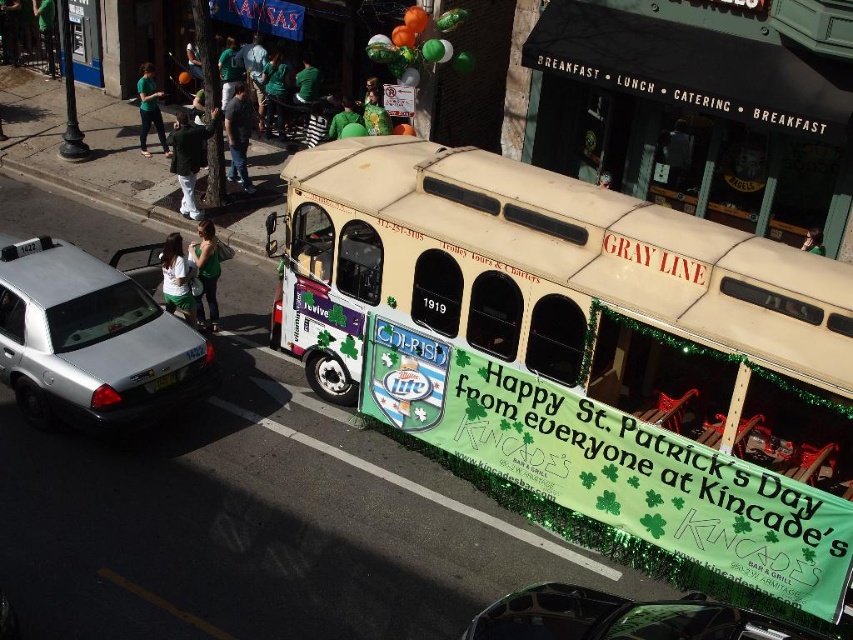
You are standing on the sidewalk next to the silver metallic taxi cab at left. You want to cross the street to reach the other side. The crosswalk is 10 meters away from you. Can you safely cross the street before a car traveling at 20 km per hour arrives? Assume the car is 30 meters behind you and approaching at a constant speed. Calculate the time it takes for the car to reach you and compare it with the time needed to cross the street.

The car is 30 meters behind you and approaching at 20 km per hour. Converting 20 km per hour to meters per second gives approximately 5.56 m per second. The time for the car to reach you is 30 meters divided by 5.56 m per second, which is about 5.4 seconds. To cross 10 meters at a walking speed of 1.4 m per second, it would take about 7.1 seconds. Since the car arrives before you finish crossing, it is not safe to cross.

You are a photographer standing on the sidewalk. You want to take a photo of the silver metallic taxi cab at left and the green fabric sign at center. Which object should you focus on first if you want to capture both in a single frame without moving the camera?

The silver metallic taxi cab at left is larger in size than the green fabric sign at center, so you should focus on the taxi cab first to ensure it fills the frame appropriately before adjusting for the smaller sign.

You are a delivery person who needs to place a small package on the ground near the green fabric bag at lower left. According to the image, where exactly should you place it?

The green fabric bag at lower left is located at point [206,273], so you should place the package near that coordinate.